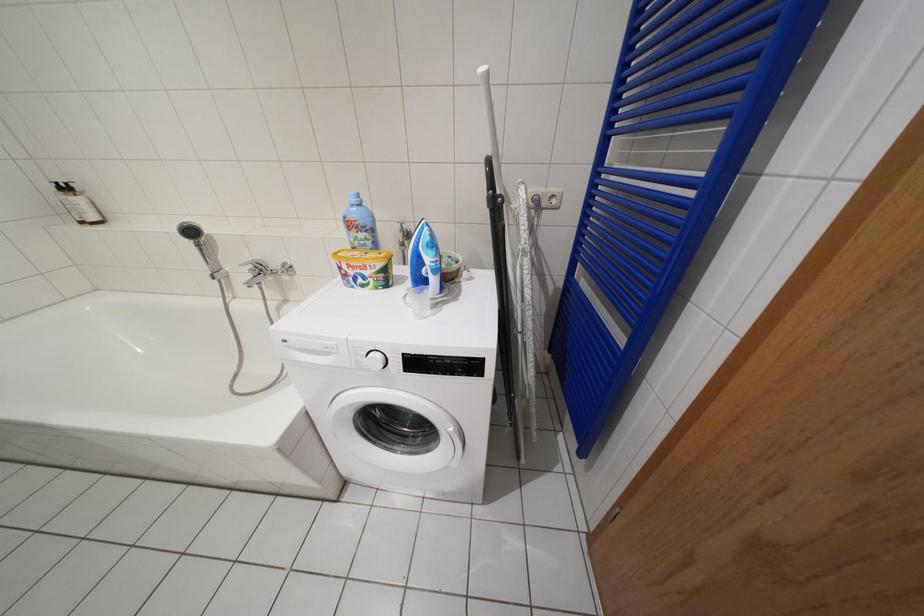
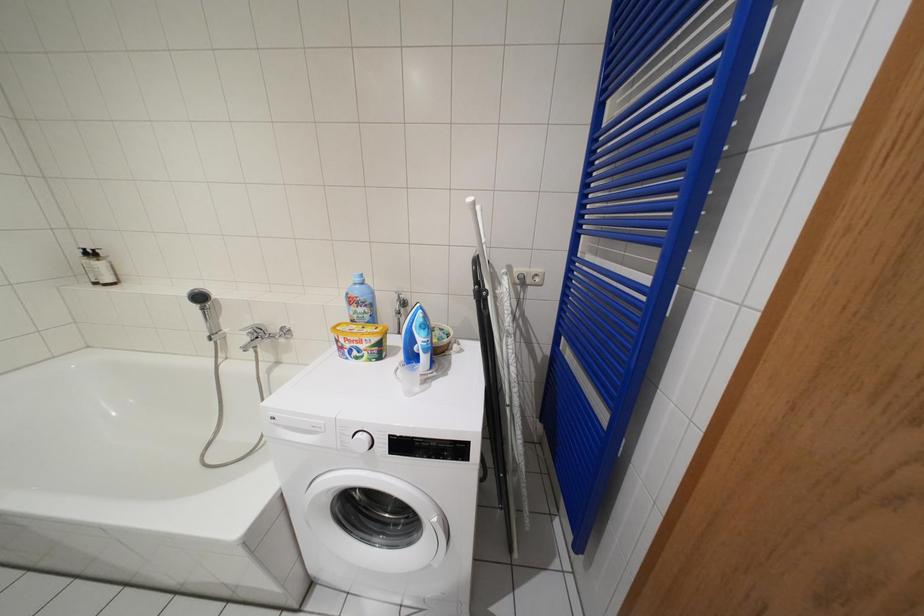
Question: Based on the continuous images, in which direction is the camera rotating? Reply with the corresponding letter.

Choices:
 (A) Left
 (B) Right
 (C) Up
 (D) Down

Answer: (C)